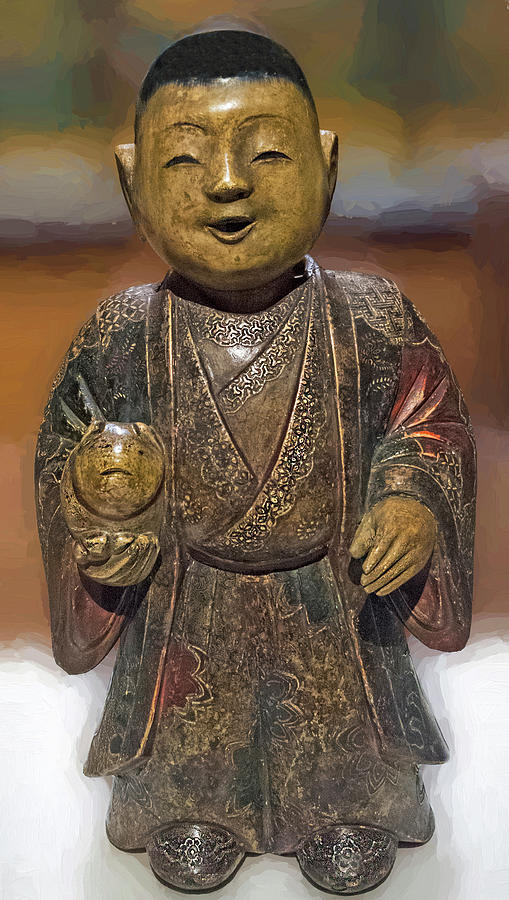
I want to click on statue, so click(304, 508).